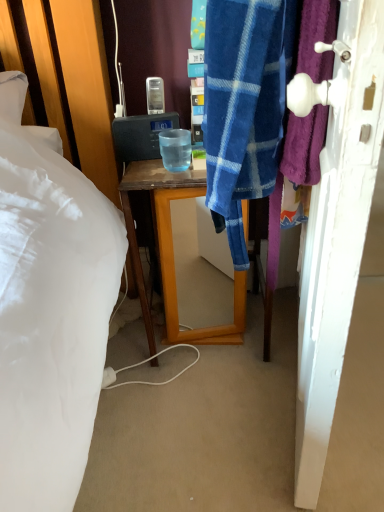
The width and height of the screenshot is (384, 512). Find the location of `wooden mirror at center`. wooden mirror at center is located at coordinates (173, 252).

The width and height of the screenshot is (384, 512). What do you see at coordinates (173, 252) in the screenshot? I see `wooden mirror at center` at bounding box center [173, 252].

At what (x,y) coordinates should I click in order to perform the action: click on wooden mirror at center. Please return your answer as a coordinate pair (x, y). The height and width of the screenshot is (512, 384). Looking at the image, I should click on (173, 252).